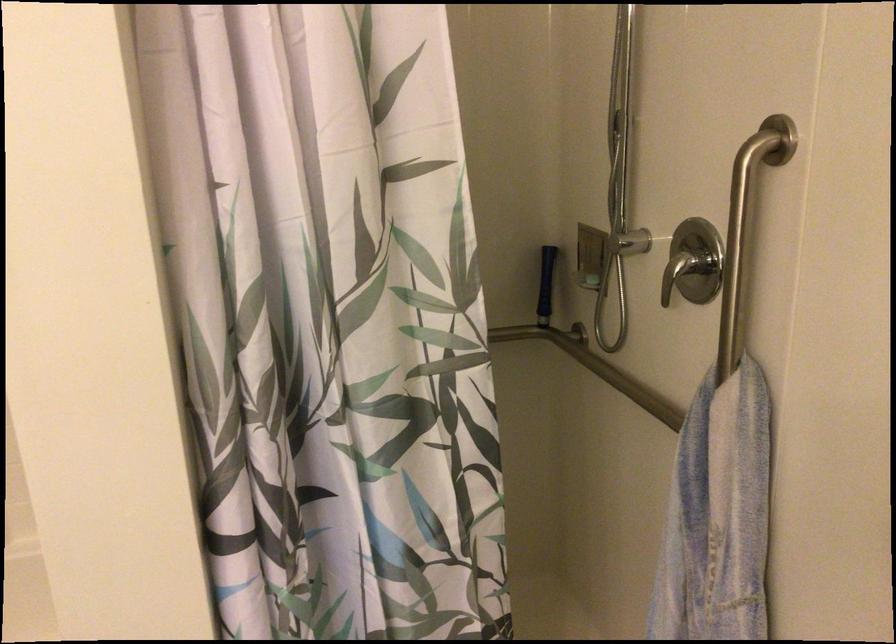
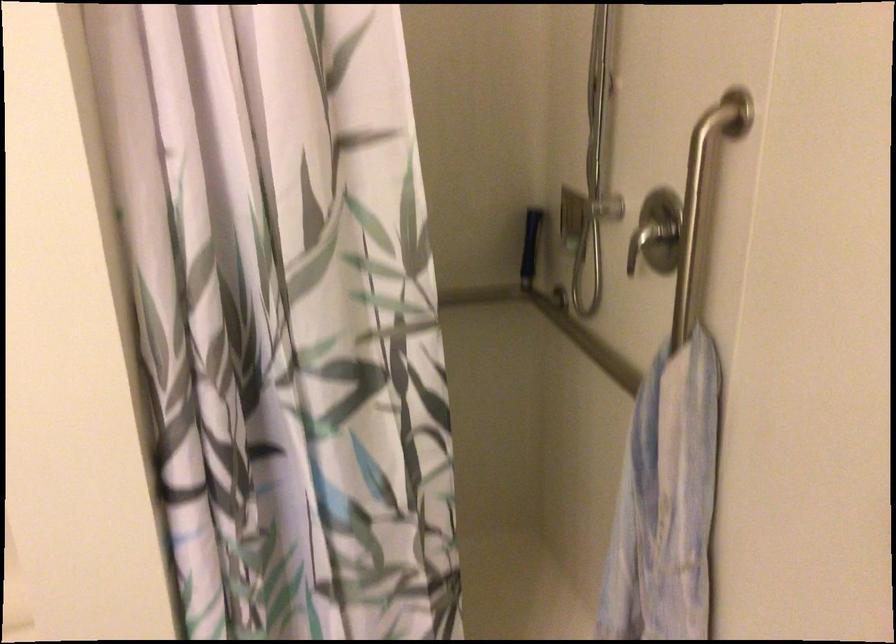
In the second image, find the point that corresponds to the point at 690,263 in the first image.

(650, 240)